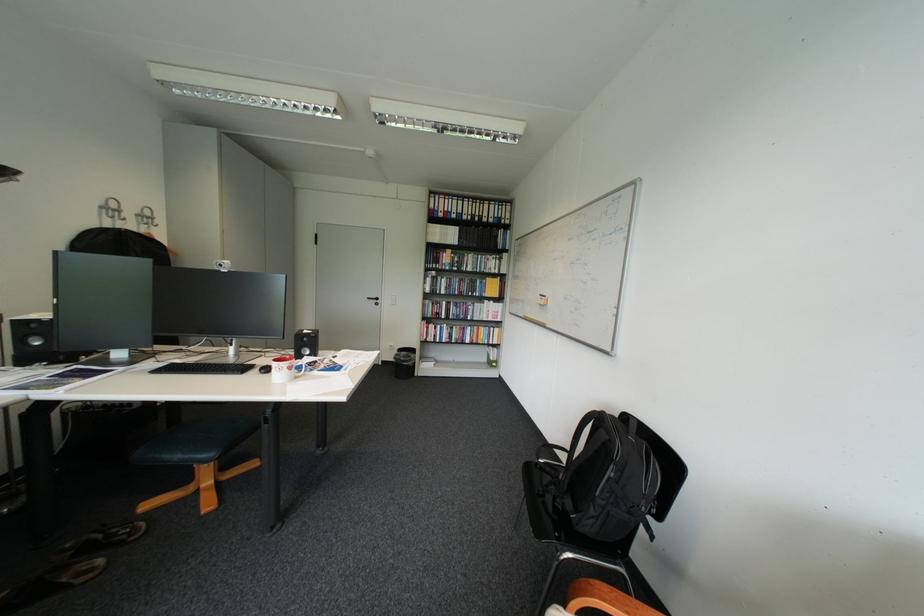
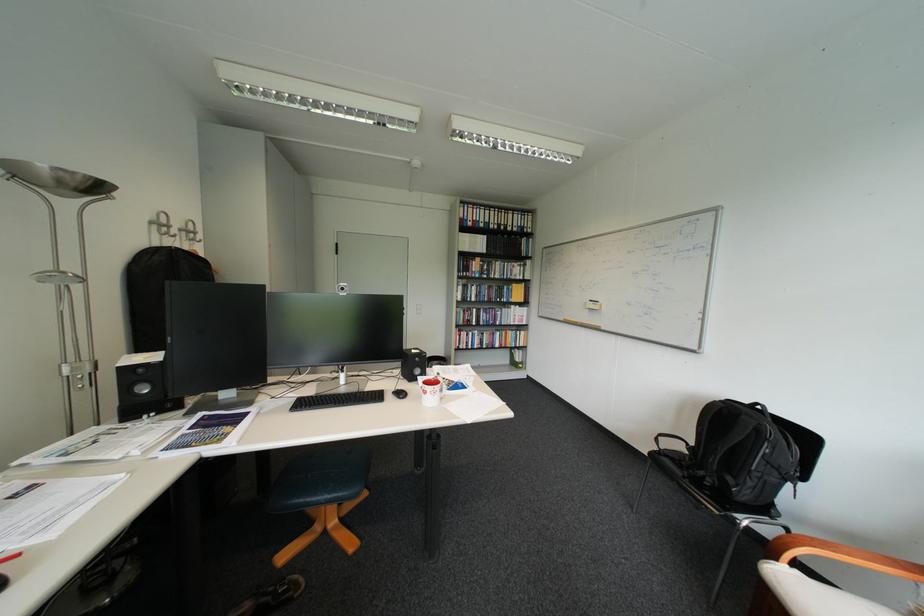
Find the pixel in the second image that matches [321,355] in the first image.

(432, 376)